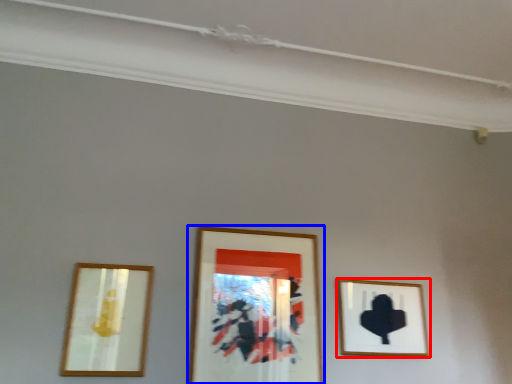
Question: Which object is closer to the camera taking this photo, picture frame (highlighted by a red box) or picture frame (highlighted by a blue box)?

Choices:
 (A) picture frame
 (B) picture frame

Answer: (B)